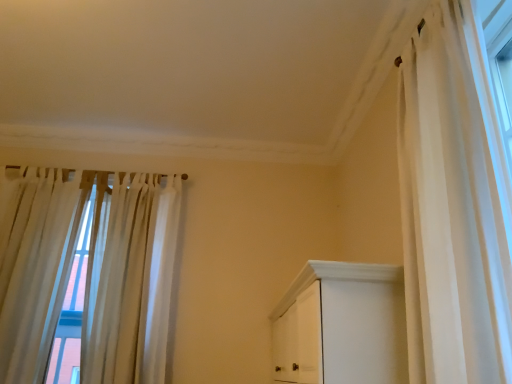
Question: Is white sheer curtain at right, the 1th curtain in the right-to-left sequence, outside of white sheer curtain at left, the 2th curtain positioned from the front?

Choices:
 (A) no
 (B) yes

Answer: (B)

Question: Can you confirm if white sheer curtain at right, which is counted as the third curtain, starting from the left, is taller than white sheer curtain at left, the 2th curtain positioned from the front?

Choices:
 (A) yes
 (B) no

Answer: (B)

Question: Considering the relative sizes of white sheer curtain at right, the 3th curtain viewed from the back, and white sheer curtain at left, the third curtain positioned from the right, in the image provided, is white sheer curtain at right, the 3th curtain viewed from the back, smaller than white sheer curtain at left, the third curtain positioned from the right,?

Choices:
 (A) no
 (B) yes

Answer: (B)

Question: Would you consider white sheer curtain at right, the 3th curtain viewed from the back, to be distant from white sheer curtain at left, the third curtain positioned from the right?

Choices:
 (A) no
 (B) yes

Answer: (B)

Question: Does white sheer curtain at right, the 1th curtain in the right-to-left sequence, appear on the right side of white sheer curtain at left, the third curtain positioned from the right?

Choices:
 (A) no
 (B) yes

Answer: (B)

Question: In terms of width, does white sheer curtain at right, which is the 1th curtain from front to back, look wider or thinner when compared to white sheer curtain at left, which ranks as the 1th curtain in left-to-right order?

Choices:
 (A) thin
 (B) wide

Answer: (B)

Question: From the image's perspective, is white sheer curtain at right, which is counted as the third curtain, starting from the left, positioned above or below white sheer curtain at left, the 2th curtain positioned from the front?

Choices:
 (A) below
 (B) above

Answer: (B)

Question: Is white sheer curtain at right, the 3th curtain viewed from the back, inside the boundaries of white sheer curtain at left, the 2th curtain positioned from the front, or outside?

Choices:
 (A) inside
 (B) outside

Answer: (B)

Question: Is point (407, 59) positioned closer to the camera than point (74, 268)?

Choices:
 (A) closer
 (B) farther

Answer: (A)

Question: Is sheer white curtains at left, which is the 3th curtain from front to back, inside the boundaries of white sheer curtain at left, the second curtain viewed from the back, or outside?

Choices:
 (A) outside
 (B) inside

Answer: (A)

Question: In terms of width, does sheer white curtains at left, positioned as the 2th curtain in right-to-left order, look wider or thinner when compared to white sheer curtain at left, the third curtain positioned from the right?

Choices:
 (A) wide
 (B) thin

Answer: (B)

Question: Would you say sheer white curtains at left, positioned as the 2th curtain in right-to-left order, is to the left or to the right of white sheer curtain at left, the 2th curtain positioned from the front, in the picture?

Choices:
 (A) right
 (B) left

Answer: (A)

Question: Looking at the image, does sheer white curtains at left, acting as the 1th curtain starting from the back, seem bigger or smaller compared to white sheer curtain at left, the 2th curtain positioned from the front?

Choices:
 (A) small
 (B) big

Answer: (A)

Question: Considering the positions of white sheer curtain at left, the second curtain viewed from the back, and sheer white curtains at left, acting as the second curtain starting from the left, in the image, is white sheer curtain at left, the second curtain viewed from the back, wider or thinner than sheer white curtains at left, acting as the second curtain starting from the left,?

Choices:
 (A) thin
 (B) wide

Answer: (B)

Question: From the image's perspective, is white sheer curtain at left, the third curtain positioned from the right, above or below sheer white curtains at left, acting as the second curtain starting from the left?

Choices:
 (A) below
 (B) above

Answer: (B)